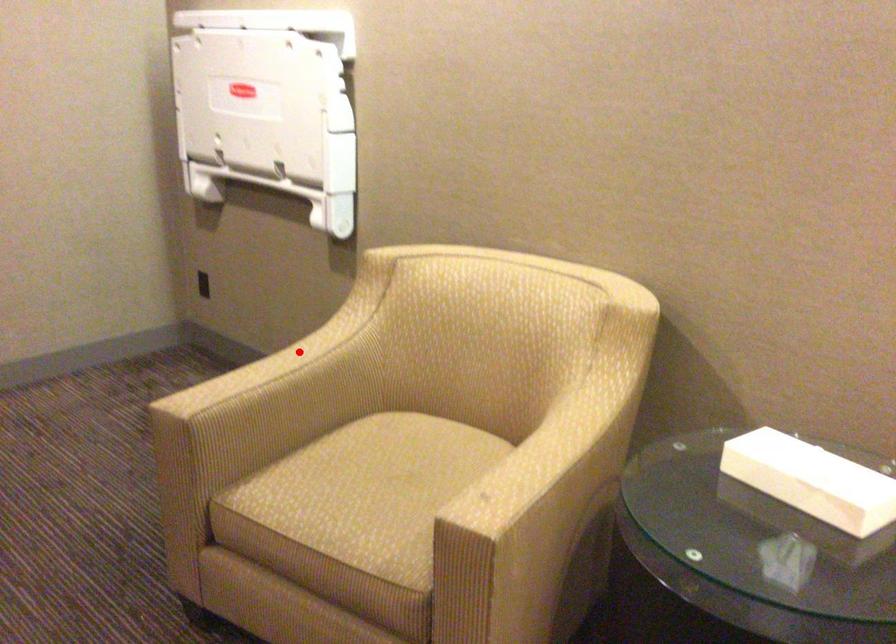
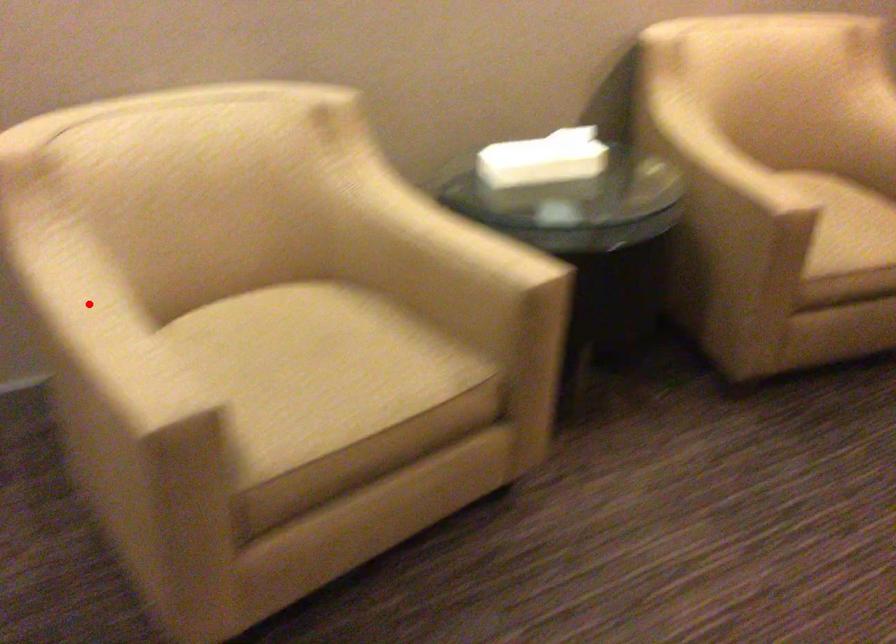
I am providing you with two images of the same scene from different viewpoints. A red point is marked on the first image and another point is marked on the second image. Are the points marked in image1 and image2 representing the same 3D position?

Yes